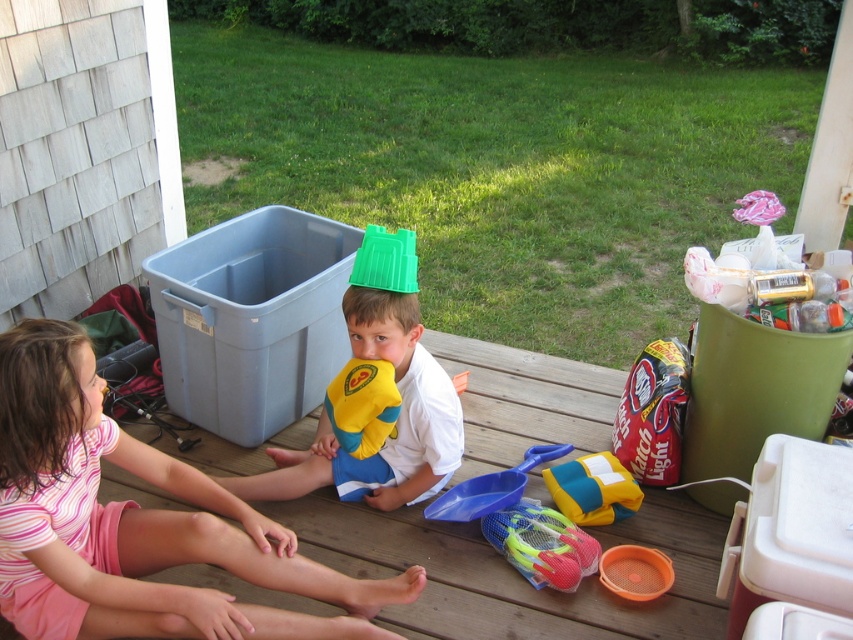
You are a parent trying to retrieve the green plastic bucket at center and the blue plastic shovel at center from the deck. Which object should you pick up first if you want to grab the one closest to you?

The green plastic bucket at center is closer to the viewer than the blue plastic shovel at center, so you should pick up the green plastic bucket at center first.